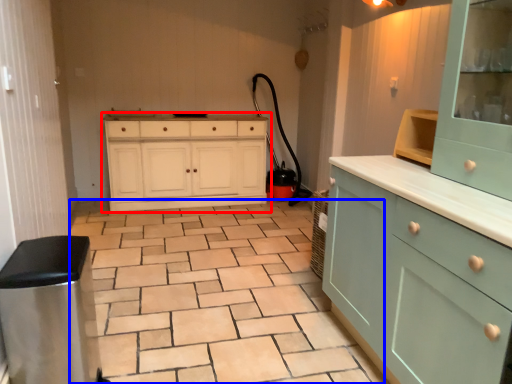
Question: Which of the following is the closest to the observer, chest of drawers (highlighted by a red box) or ceramic tile (highlighted by a blue box)?

Choices:
 (A) chest of drawers
 (B) ceramic tile

Answer: (B)